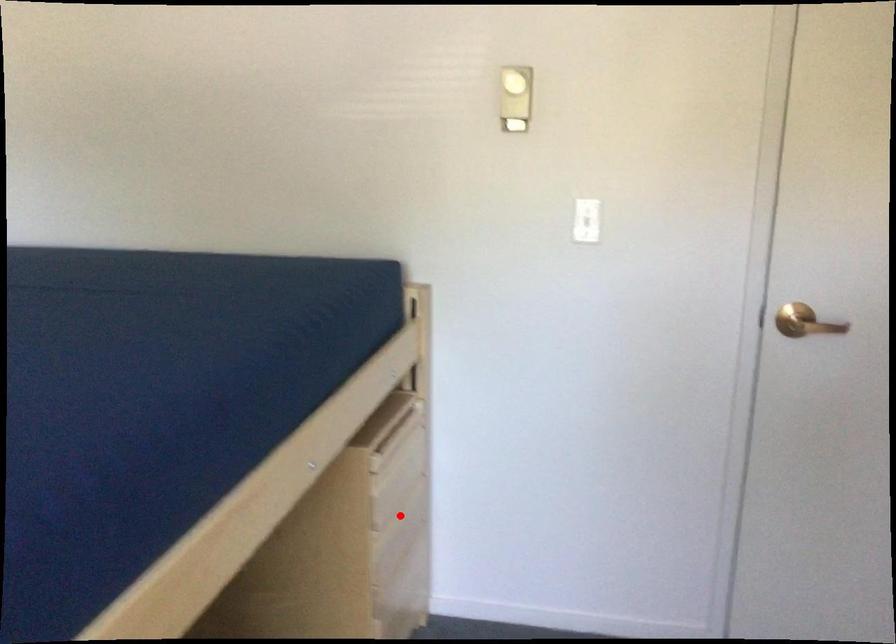
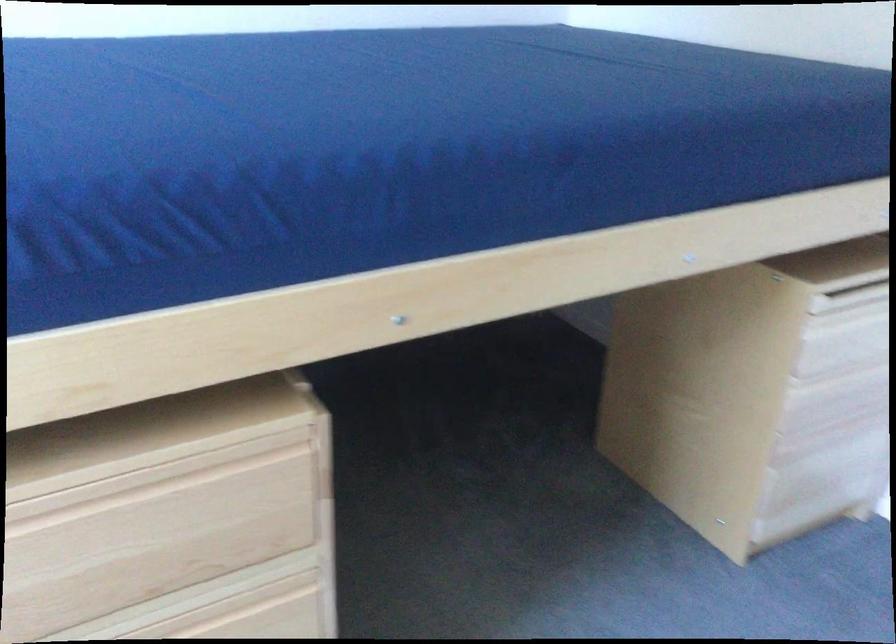
Question: I am providing you with two images of the same scene from different viewpoints. Image1 has a red point marked. In image2, the corresponding 3D location appears at what relative position? Reply with the corresponding letter.

Choices:
 (A) Closer
 (B) Farther

Answer: (A)